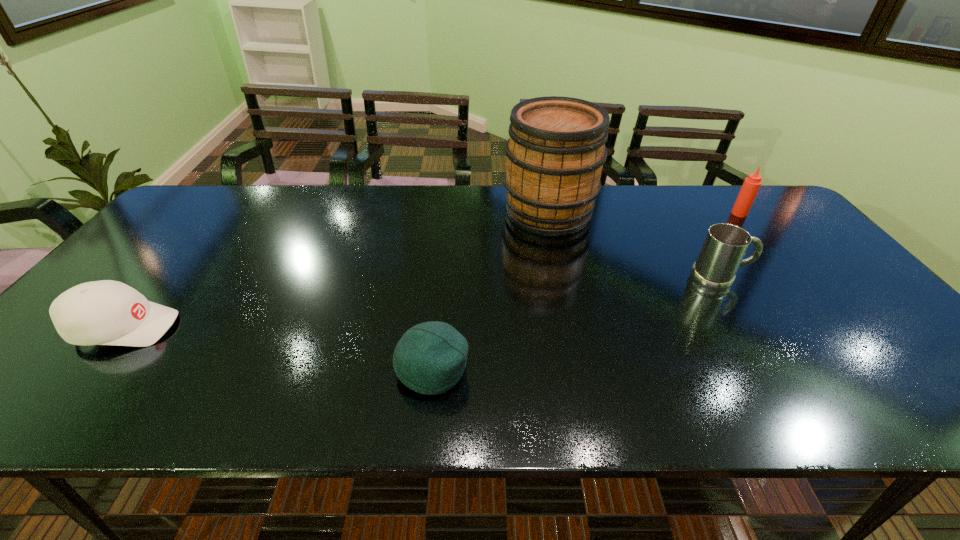
At what (x,y) coordinates should I click in order to perform the action: click on vacant point at the left edge. Please return your answer as a coordinate pair (x, y). This screenshot has width=960, height=540. Looking at the image, I should click on (145, 265).

This screenshot has width=960, height=540. In order to click on vacant space at the right edge in this screenshot , I will do `click(869, 345)`.

You are a GUI agent. You are given a task and a screenshot of the screen. Output one action in this format:
    pyautogui.click(x=<x>, y=<y>)
    Task: Click on the free space between the mug and the second object from left to right
    This screenshot has height=540, width=960.
    Given the screenshot: What is the action you would take?
    pyautogui.click(x=576, y=323)

Where is `free space between the cider and the second object from right to left`? This screenshot has height=540, width=960. free space between the cider and the second object from right to left is located at coordinates (634, 245).

Identify the location of unoccupied position between the third object from right to left and the third nearest object. This screenshot has width=960, height=540. (634, 245).

I want to click on empty space between the leftmost object and the second object from right to left, so click(421, 303).

I want to click on free space between the tallest object and the beanie, so click(x=491, y=290).

Find the location of a particular element. This screenshot has width=960, height=540. vacant area that lies between the tallest object and the leftmost object is located at coordinates 336,269.

Image resolution: width=960 pixels, height=540 pixels. What are the coordinates of `empty space that is in between the baseball cap and the fourth object from left to right` in the screenshot? It's located at (421, 303).

At what (x,y) coordinates should I click in order to perform the action: click on empty location between the second object from left to right and the baseball cap. Please return your answer as a coordinate pair (x, y). The width and height of the screenshot is (960, 540). Looking at the image, I should click on (278, 348).